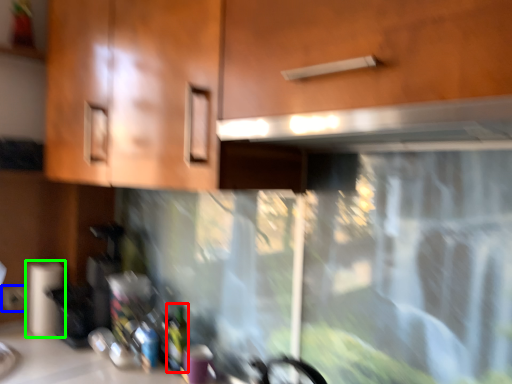
Question: Which object is positioned farthest from bottle (highlighted by a red box)? Select from electric outlet (highlighted by a blue box) and paper towel (highlighted by a green box).

Choices:
 (A) electric outlet
 (B) paper towel

Answer: (A)